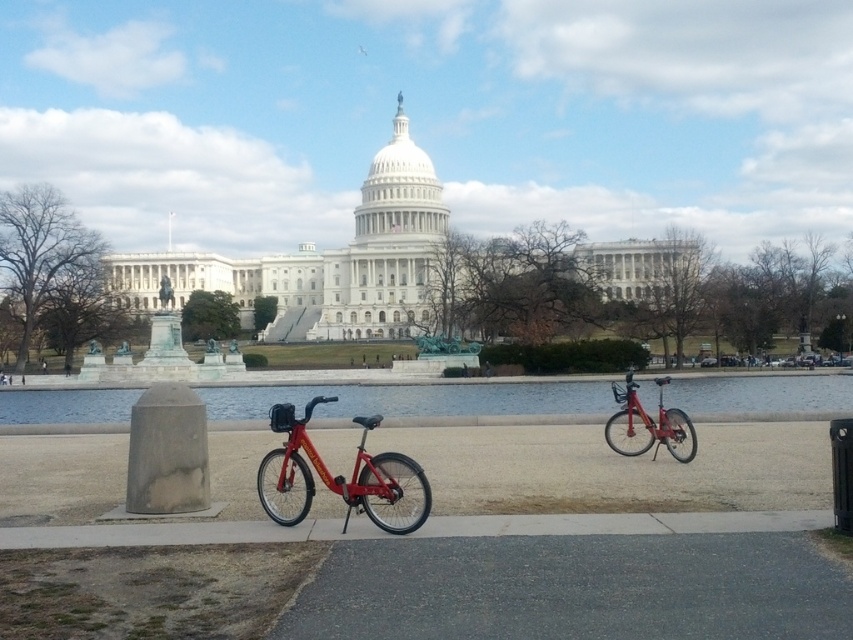
You are visiting the United States Capitol and want to take a photo of the clear water at center and the metallic red bicycle at right. Which object should you focus on first if you want to capture both in a single frame without moving your camera? Explain your reasoning based on their positions.

The clear water at center is to the left of the metallic red bicycle at right. To capture both in a single frame without moving the camera, you should focus on the metallic red bicycle at right first since it is positioned further to the right, allowing the water to be included on its left side in the same frame.

You are standing at the point marked by the coordinate point at (415, 400) in the image of the United States Capitol. What is the nearest object to you in the scene?

The nearest object to you at point (415, 400) is the clear water at center, as the point is located on it.